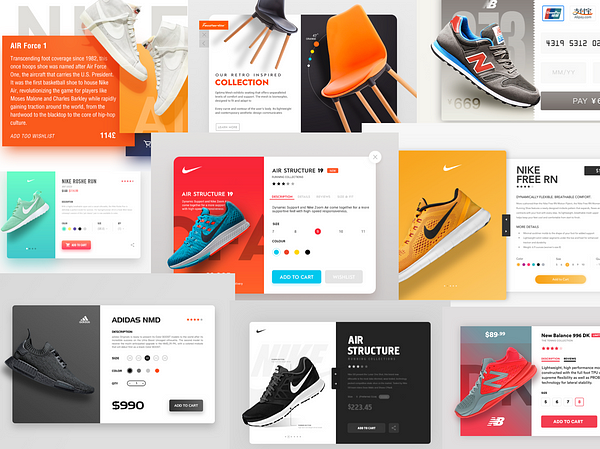
This screenshot has width=600, height=449. I want to click on chair legs on black chair, so click(x=246, y=24), click(x=258, y=36), click(x=264, y=40), click(x=282, y=49).